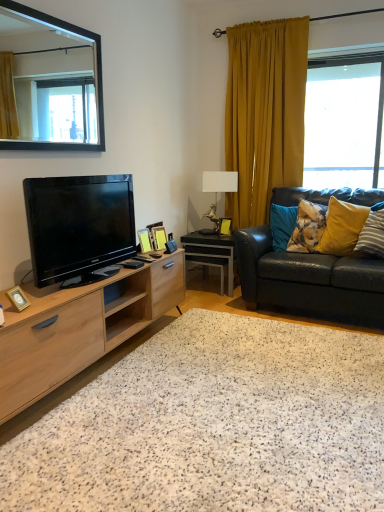
Question: Considering their positions, is black glossy tv at left located in front of or behind metallic gold lamp at center?

Choices:
 (A) front
 (B) behind

Answer: (A)

Question: Is point (99, 225) closer or farther from the camera than point (208, 178)?

Choices:
 (A) farther
 (B) closer

Answer: (B)

Question: Estimate the real-world distances between objects in this image. Which object is farther from the metallic gold lamp at center?

Choices:
 (A) black glossy tv at left
 (B) wooden picture frame at center, the 2th picture frame viewed from the left
 (C) wooden picture frame at center, which is the second picture frame in back-to-front order
 (D) mustard yellow fabric curtain at right
 (E) fluffy blue pillow at right, which is the 1th pillow from left to right

Answer: (A)

Question: Considering the real-world distances, which object is closest to the wooden picture frame at center, which is counted as the 3th picture frame, starting from the right?

Choices:
 (A) natural wood cabinet at left
 (B) black glossy tv at left
 (C) wooden picture frame at center, the third picture frame from the left
 (D) gold metallic photo frame at lower left, which is the fourth picture frame in top-to-bottom order
 (E) yellow fabric pillow at right, which is the third pillow from left to right

Answer: (C)